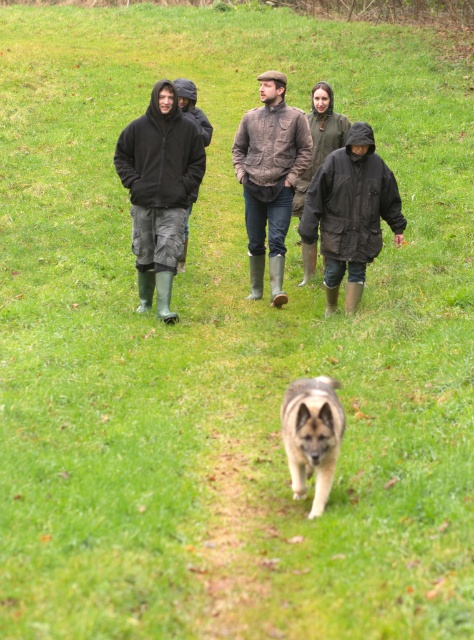
You are a photographer trying to capture a candid shot of the two people in the dark brown leather jacket at center and the matte black jacket at left. Your camera has a maximum focus range of 4 inches. Can you fit both subjects into the same frame without moving the camera?

The distance between the dark brown leather jacket at center and the matte black jacket at left is 4.11 inches. Since your camera can only focus within 4 inches, you cannot fit both subjects into the same frame without moving the camera.

You are standing on the grassy path and see two points marked on the ground. One is at point (127, 145) and the other is at point (362, 240). Which point is closer to you?

Point (127, 145) is further to the camera than point (362, 240), so the point closer to you is point (362, 240).

You are a photographer positioned on the grassy path and want to capture both the matte black jacket at left and the dark matte jacket at center in the same frame. Which direction should you move to ensure both are visible?

Since the matte black jacket at left is to the left of the dark matte jacket at center, you should move to the right to ensure both are visible in the frame.